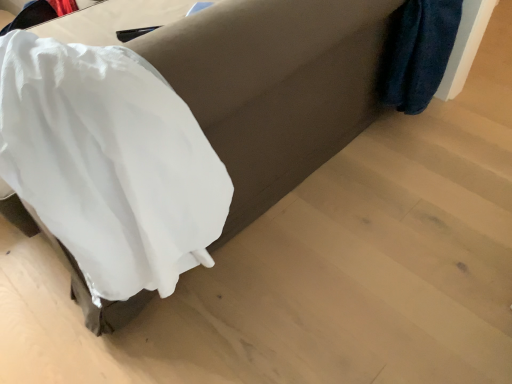
Question: Is white fabric at lower left taller than white fabric at lower left?

Choices:
 (A) no
 (B) yes

Answer: (A)

Question: Does white fabric at lower left have a larger size compared to white fabric at lower left?

Choices:
 (A) yes
 (B) no

Answer: (B)

Question: From a real-world perspective, is white fabric at lower left under white fabric at lower left?

Choices:
 (A) yes
 (B) no

Answer: (B)

Question: Is white fabric at lower left smaller than white fabric at lower left?

Choices:
 (A) yes
 (B) no

Answer: (A)

Question: Does white fabric at lower left appear on the left side of white fabric at lower left?

Choices:
 (A) no
 (B) yes

Answer: (B)

Question: From a real-world perspective, is white fabric at lower left on white fabric at lower left?

Choices:
 (A) no
 (B) yes

Answer: (B)

Question: Can you confirm if white fabric at lower left is positioned to the left of white fabric at lower left?

Choices:
 (A) no
 (B) yes

Answer: (A)

Question: From a real-world perspective, is white fabric at lower left on white fabric at lower left?

Choices:
 (A) yes
 (B) no

Answer: (B)

Question: Is white fabric at lower left smaller than white fabric at lower left?

Choices:
 (A) yes
 (B) no

Answer: (B)

Question: Is white fabric at lower left surrounded by white fabric at lower left?

Choices:
 (A) no
 (B) yes

Answer: (B)

Question: Is white fabric at lower left further to camera compared to white fabric at lower left?

Choices:
 (A) yes
 (B) no

Answer: (A)

Question: Does white fabric at lower left appear on the right side of white fabric at lower left?

Choices:
 (A) no
 (B) yes

Answer: (B)

Question: Is point (174, 253) closer or farther from the camera than point (180, 29)?

Choices:
 (A) closer
 (B) farther

Answer: (A)